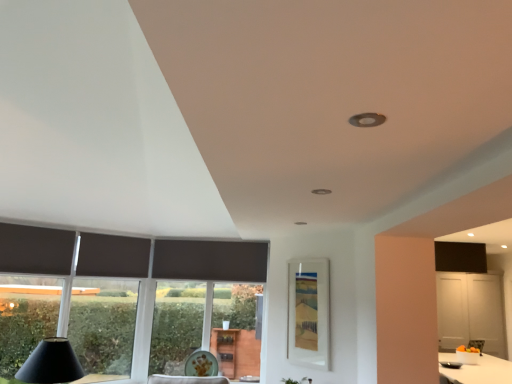
Question: Is matte glass window screen at center situated inside dark matte curtain at left, which is the second curtain in right-to-left order, or outside?

Choices:
 (A) outside
 (B) inside

Answer: (A)

Question: In terms of height, does matte glass window screen at center look taller or shorter compared to dark matte curtain at left, the 1th curtain positioned from the left?

Choices:
 (A) short
 (B) tall

Answer: (B)

Question: Which object is positioned closest to the dark matte curtain at left, which is the second curtain in front-to-back order?

Choices:
 (A) matte black cone at lower left
 (B) dark matte curtain at left, the 1th curtain positioned from the left
 (C) porcelain plate at lower center
 (D) transparent glass window at left
 (E) matte glass window screen at center

Answer: (B)

Question: Which of these objects is positioned closest to the dark matte curtain at left, which is the second curtain in right-to-left order?

Choices:
 (A) transparent glass window at left
 (B) dark matte curtain at left, which appears as the first curtain when viewed from the back
 (C) matte black cone at lower left
 (D) porcelain plate at lower center
 (E) matte glass window screen at center

Answer: (B)